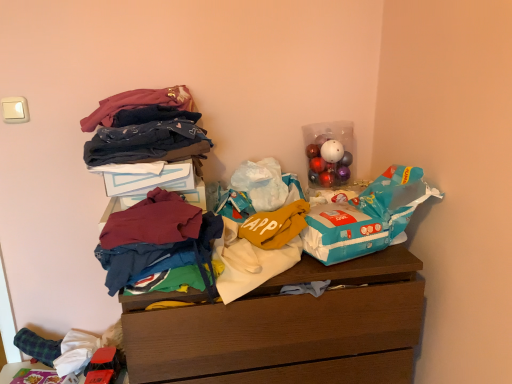
Question: Considering the relative sizes of velvet-like fabric at upper left, positioned as the first clothing in top-to-bottom order, and blue plastic grocery bag at upper right in the image provided, is velvet-like fabric at upper left, positioned as the first clothing in top-to-bottom order, smaller than blue plastic grocery bag at upper right?

Choices:
 (A) yes
 (B) no

Answer: (A)

Question: Is velvet-like fabric at upper left, positioned as the first clothing in top-to-bottom order, beside blue plastic grocery bag at upper right?

Choices:
 (A) yes
 (B) no

Answer: (B)

Question: Would you say blue plastic grocery bag at upper right is part of velvet-like fabric at upper left, positioned as the first clothing in top-to-bottom order,'s contents?

Choices:
 (A) yes
 (B) no

Answer: (B)

Question: Is velvet-like fabric at upper left, positioned as the first clothing in top-to-bottom order, positioned with its back to blue plastic grocery bag at upper right?

Choices:
 (A) no
 (B) yes

Answer: (A)

Question: Is the depth of velvet-like fabric at upper left, the fourth clothing ordered from the bottom, less than that of blue plastic grocery bag at upper right?

Choices:
 (A) yes
 (B) no

Answer: (B)

Question: From the image's perspective, relative to shiny plastic ornaments at upper right, is wooden chest of drawers at center above or below?

Choices:
 (A) above
 (B) below

Answer: (B)

Question: Would you say wooden chest of drawers at center is to the left or to the right of shiny plastic ornaments at upper right in the picture?

Choices:
 (A) right
 (B) left

Answer: (B)

Question: Is wooden chest of drawers at center inside or outside of shiny plastic ornaments at upper right?

Choices:
 (A) outside
 (B) inside

Answer: (A)

Question: Does point (382, 309) appear closer or farther from the camera than point (317, 139)?

Choices:
 (A) farther
 (B) closer

Answer: (B)

Question: From a real-world perspective, is maroon fabric shirt at center, marked as the 2th clothing in a bottom-to-top arrangement, above or below wooden chest of drawers at center?

Choices:
 (A) above
 (B) below

Answer: (A)

Question: Choose the correct answer: Is maroon fabric shirt at center, the third clothing from the top, inside wooden chest of drawers at center or outside it?

Choices:
 (A) outside
 (B) inside

Answer: (A)

Question: Considering the relative positions of maroon fabric shirt at center, the third clothing from the top, and wooden chest of drawers at center in the image provided, is maroon fabric shirt at center, the third clothing from the top, to the left or to the right of wooden chest of drawers at center?

Choices:
 (A) left
 (B) right

Answer: (A)

Question: Considering the positions of maroon fabric shirt at center, the third clothing from the top, and wooden chest of drawers at center in the image, is maroon fabric shirt at center, the third clothing from the top, wider or thinner than wooden chest of drawers at center?

Choices:
 (A) thin
 (B) wide

Answer: (A)

Question: Is point (x=406, y=311) closer or farther from the camera than point (x=174, y=210)?

Choices:
 (A) farther
 (B) closer

Answer: (A)

Question: From a real-world perspective, is wooden chest of drawers at center above or below maroon fabric shirt at center, the third clothing from the top?

Choices:
 (A) below
 (B) above

Answer: (A)